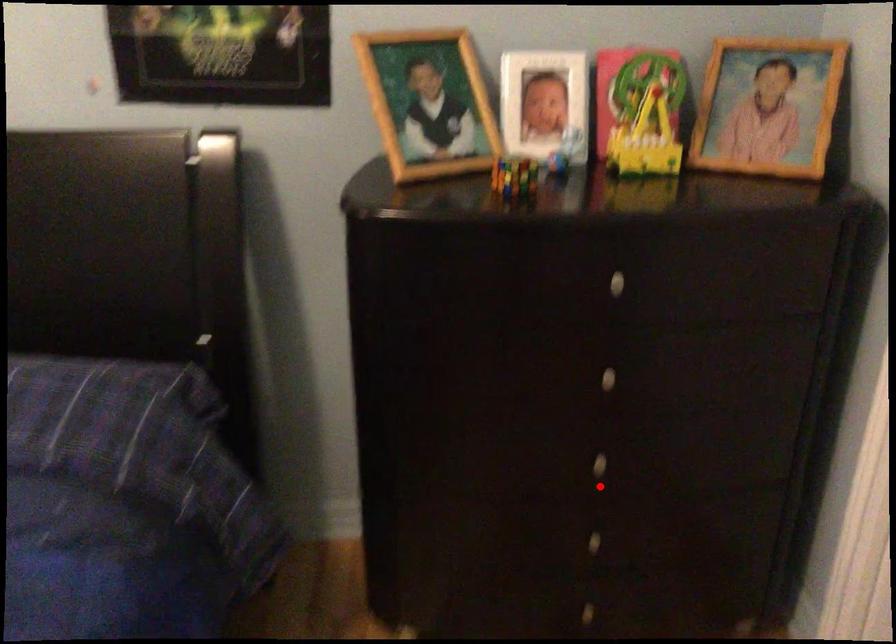
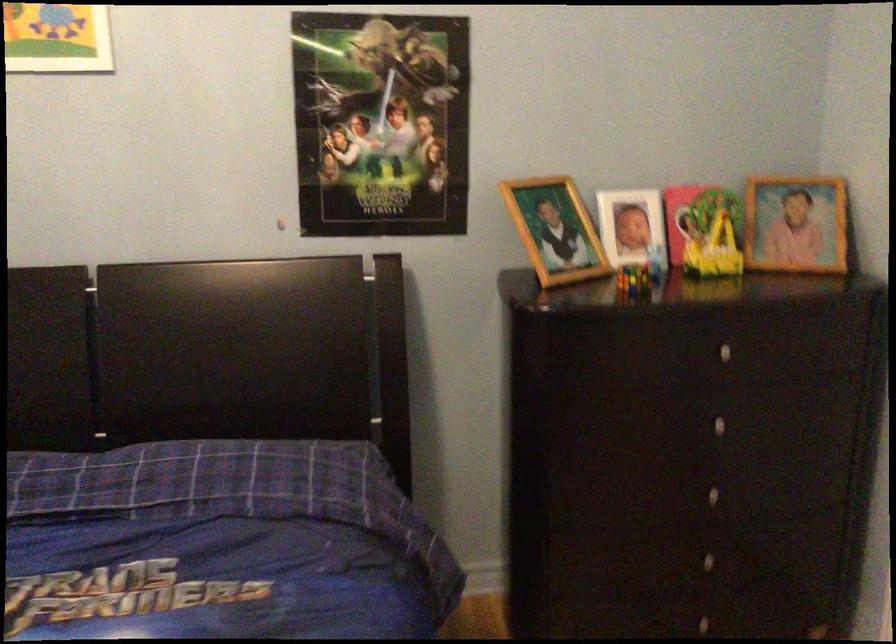
Question: I am providing you with two images of the same scene from different viewpoints. A red point is shown in image1. For the corresponding object point in image2, is it positioned nearer or farther from the camera?

Choices:
 (A) Nearer
 (B) Farther

Answer: (B)